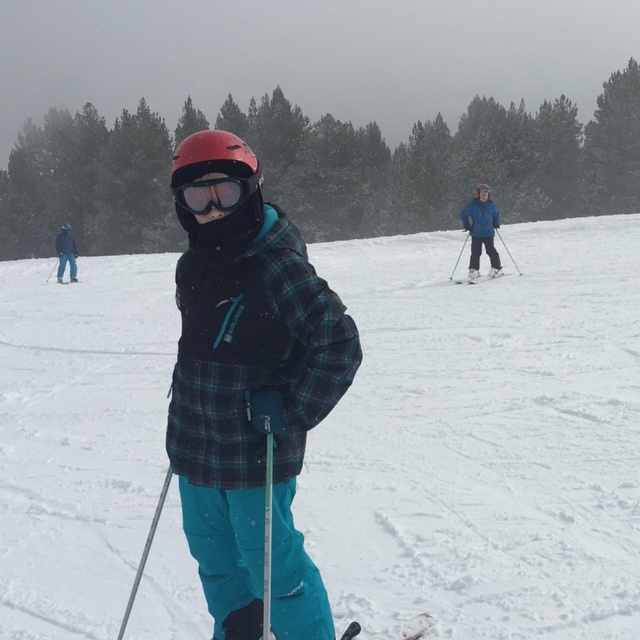
Question: Is blue matte jacket at center positioned at the back of white matte ski at right?

Choices:
 (A) no
 (B) yes

Answer: (B)

Question: Can you confirm if plaid jacket at center is thinner than matte black ski pole at center-right?

Choices:
 (A) yes
 (B) no

Answer: (A)

Question: Which of the following is the closest to the observer?

Choices:
 (A) plaid jacket at center
 (B) white matte snow at center

Answer: (A)

Question: Which object is the farthest from the black plastic ski at lower center?

Choices:
 (A) white matte snow at center
 (B) blue matte jacket at center
 (C) blue fabric jacket at left
 (D) plaid jacket at center

Answer: (C)

Question: Which of the following is the farthest from the observer?

Choices:
 (A) white matte ski at right
 (B) black plastic ski at lower center
 (C) white matte snow at center
 (D) plaid jacket at center

Answer: (A)

Question: Does plaid jacket at center have a smaller size compared to blue matte jacket at center?

Choices:
 (A) yes
 (B) no

Answer: (A)